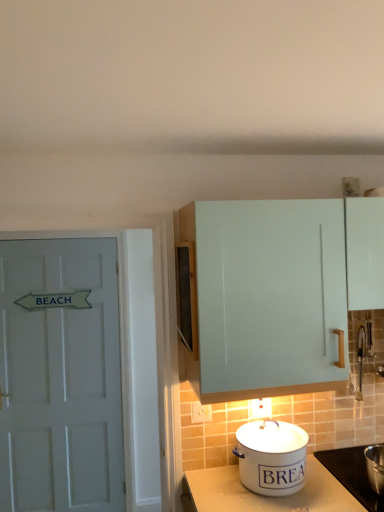
Question: Could white enamel bread bin at lower center be considered to be inside white painted wood door at left?

Choices:
 (A) yes
 (B) no

Answer: (B)

Question: Would you consider white painted wood door at left to be distant from white enamel bread bin at lower center?

Choices:
 (A) no
 (B) yes

Answer: (B)

Question: Is white painted wood door at left aimed at white enamel bread bin at lower center?

Choices:
 (A) no
 (B) yes

Answer: (A)

Question: Is the surface of white painted wood door at left in direct contact with white enamel bread bin at lower center?

Choices:
 (A) no
 (B) yes

Answer: (A)

Question: Is white painted wood door at left not inside white enamel bread bin at lower center?

Choices:
 (A) yes
 (B) no

Answer: (A)

Question: Based on their sizes in the image, would you say white enamel bread bin at lower center is bigger or smaller than white enamel pot at lower right?

Choices:
 (A) small
 (B) big

Answer: (B)

Question: Considering the positions of white enamel bread bin at lower center and white enamel pot at lower right in the image, is white enamel bread bin at lower center wider or thinner than white enamel pot at lower right?

Choices:
 (A) thin
 (B) wide

Answer: (A)

Question: From a real-world perspective, is white enamel bread bin at lower center above or below white enamel pot at lower right?

Choices:
 (A) above
 (B) below

Answer: (A)

Question: Is white enamel bread bin at lower center in front of or behind white enamel pot at lower right in the image?

Choices:
 (A) front
 (B) behind

Answer: (B)

Question: Is white enamel pot at lower right in front of or behind light blue matte cabinet at upper right in the image?

Choices:
 (A) front
 (B) behind

Answer: (B)

Question: From a real-world perspective, relative to light blue matte cabinet at upper right, is white enamel pot at lower right vertically above or below?

Choices:
 (A) above
 (B) below

Answer: (B)

Question: Based on their sizes in the image, would you say white enamel pot at lower right is bigger or smaller than light blue matte cabinet at upper right?

Choices:
 (A) small
 (B) big

Answer: (A)

Question: Is white enamel pot at lower right wider or thinner than light blue matte cabinet at upper right?

Choices:
 (A) wide
 (B) thin

Answer: (A)

Question: Is white enamel pot at lower right spatially inside white enamel bread bin at lower center, or outside of it?

Choices:
 (A) outside
 (B) inside

Answer: (A)

Question: Based on their positions, is white enamel pot at lower right located to the left or right of white enamel bread bin at lower center?

Choices:
 (A) left
 (B) right

Answer: (B)